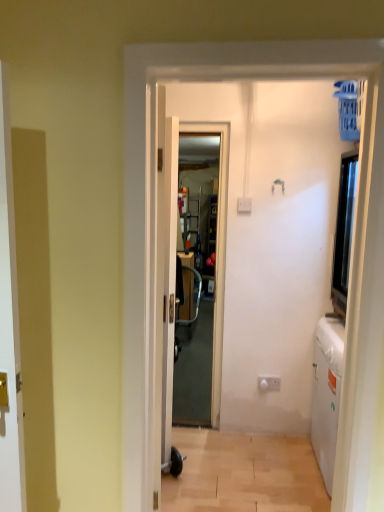
Describe the element at coordinates (217, 252) in the screenshot. I see `transparent plastic screen door at center` at that location.

Measure the distance between point (192,451) and camera.

8.88 feet.

What are the coordinates of `transparent plastic screen door at center` in the screenshot? It's located at (217, 252).

Is light brown wood floor at lower center positioned in front of white glossy door at center?

Yes, light brown wood floor at lower center is in front of white glossy door at center.

Can we say light brown wood floor at lower center lies outside white glossy door at center?

light brown wood floor at lower center lies outside white glossy door at center's area.

Which of these two, light brown wood floor at lower center or white glossy door at center, stands shorter?

Standing shorter between the two is light brown wood floor at lower center.

Consider the image. Between light brown wood floor at lower center and white glossy door at center, which one has smaller size?

Smaller between the two is light brown wood floor at lower center.

From the image's perspective, relative to white glossy door at center, is white glossy electric outlet at lower center above or below?

From the image's perspective, white glossy electric outlet at lower center appears below white glossy door at center.

From a real-world perspective, is white glossy electric outlet at lower center physically above white glossy door at center?

No, from a real-world perspective, white glossy electric outlet at lower center is not on top of white glossy door at center.

Can you tell me how much white glossy electric outlet at lower center and white glossy door at center differ in facing direction?

There is a 112-degree angle between the facing directions of white glossy electric outlet at lower center and white glossy door at center.

Can you confirm if white glossy electric outlet at lower center is shorter than white glossy door at center?

Indeed, white glossy electric outlet at lower center has a lesser height compared to white glossy door at center.

Can you confirm if light brown wood floor at lower center is shorter than transparent plastic screen door at center?

Yes, light brown wood floor at lower center is shorter than transparent plastic screen door at center.

Is light brown wood floor at lower center with transparent plastic screen door at center?

No, light brown wood floor at lower center is not with transparent plastic screen door at center.

Considering the points (313, 468) and (217, 417), which point is behind, point (313, 468) or point (217, 417)?

Point (217, 417)

Which object is positioned more to the right, light brown wood floor at lower center or transparent plastic screen door at center?

From the viewer's perspective, light brown wood floor at lower center appears more on the right side.

Is transparent plastic screen door at center oriented away from light brown wood floor at lower center?

No.

Measure the distance between transparent plastic screen door at center and light brown wood floor at lower center.

transparent plastic screen door at center and light brown wood floor at lower center are 59.32 centimeters apart from each other.

Considering the points (221, 229) and (253, 476), which point is behind, point (221, 229) or point (253, 476)?

Point (221, 229)

From the image's perspective, which is above, transparent plastic screen door at center or light brown wood floor at lower center?

transparent plastic screen door at center.

Is white glossy door at center positioned before white glossy electric outlet at lower center?

Yes, white glossy door at center is closer to the viewer.

Who is taller, white glossy door at center or white glossy electric outlet at lower center?

Standing taller between the two is white glossy door at center.

Is white glossy door at center looking in the opposite direction of white glossy electric outlet at lower center?

No.

Looking at this image, can you tell me how much light brown wood floor at lower center and white glossy electric outlet at lower center differ in facing direction?

1.58 degrees.

Which is nearer, (277, 482) or (272, 386)?

The point (277, 482) is more forward.

Where is `corridor in front of the white glossy electric outlet at lower center`? This screenshot has width=384, height=512. corridor in front of the white glossy electric outlet at lower center is located at coordinates (244, 474).

Looking at this image, how far apart are white glossy electric outlet at lower center and light brown wood floor at lower center?

white glossy electric outlet at lower center is 22.40 inches from light brown wood floor at lower center.

Is white glossy electric outlet at lower center positioned in front of light brown wood floor at lower center?

No, white glossy electric outlet at lower center is further to the viewer.

Which object is positioned more to the right, white glossy electric outlet at lower center or light brown wood floor at lower center?

white glossy electric outlet at lower center.

In terms of width, does white glossy electric outlet at lower center look wider or thinner when compared to light brown wood floor at lower center?

Clearly, white glossy electric outlet at lower center has less width compared to light brown wood floor at lower center.

This screenshot has height=512, width=384. In the image, there is a light brown wood floor at lower center. What are the coordinates of `door above it (from the image's perspective)` in the screenshot? It's located at (165, 283).

Image resolution: width=384 pixels, height=512 pixels. I want to click on electric outlet below the white glossy door at center (from the image's perspective), so click(269, 383).

From the image, which object appears to be nearer to white glossy door at center, light brown wood floor at lower center or transparent plastic screen door at center?

transparent plastic screen door at center is positioned closer to the anchor white glossy door at center.

When comparing their distances from transparent plastic screen door at center, does white glossy door at center or light brown wood floor at lower center seem closer?

white glossy door at center.

Which object lies further to the anchor point transparent plastic screen door at center, white glossy door at center or white glossy electric outlet at lower center?

The object further to transparent plastic screen door at center is white glossy electric outlet at lower center.

Looking at the image, which one is located further to white glossy door at center, white glossy electric outlet at lower center or light brown wood floor at lower center?

white glossy electric outlet at lower center.

Which object lies further to the anchor point white glossy electric outlet at lower center, transparent plastic screen door at center or light brown wood floor at lower center?

Based on the image, transparent plastic screen door at center appears to be further to white glossy electric outlet at lower center.

Based on the photo, considering their positions, is light brown wood floor at lower center positioned further to white glossy electric outlet at lower center than white glossy door at center?

Among the two, white glossy door at center is located further to white glossy electric outlet at lower center.

Looking at the image, which one is located further to white glossy door at center, transparent plastic screen door at center or white glossy electric outlet at lower center?

white glossy electric outlet at lower center is positioned further to the anchor white glossy door at center.

From the image, which object appears to be nearer to light brown wood floor at lower center, white glossy door at center or transparent plastic screen door at center?

The object closer to light brown wood floor at lower center is transparent plastic screen door at center.

Locate an element on the screen. The image size is (384, 512). door between transparent plastic screen door at center and white glossy electric outlet at lower center in the up-down direction is located at coordinates (165, 283).

Identify the location of electric outlet between white glossy door at center and light brown wood floor at lower center in the vertical direction. Image resolution: width=384 pixels, height=512 pixels. (269, 383).

Find the location of `door between transparent plastic screen door at center and light brown wood floor at lower center from top to bottom`. door between transparent plastic screen door at center and light brown wood floor at lower center from top to bottom is located at coordinates (165, 283).

Where is `electric outlet between transparent plastic screen door at center and light brown wood floor at lower center in the vertical direction`? electric outlet between transparent plastic screen door at center and light brown wood floor at lower center in the vertical direction is located at coordinates (269, 383).